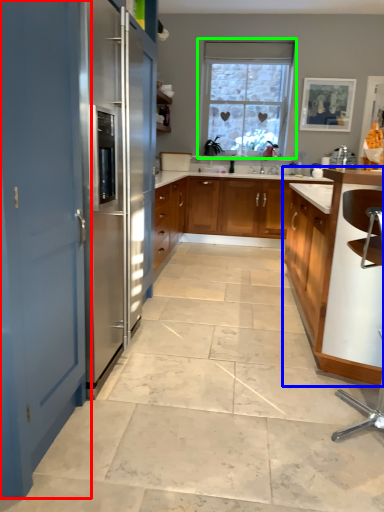
Question: Which is nearer to the door (highlighted by a red box)? cabinetry (highlighted by a blue box) or window (highlighted by a green box).

Choices:
 (A) cabinetry
 (B) window

Answer: (A)